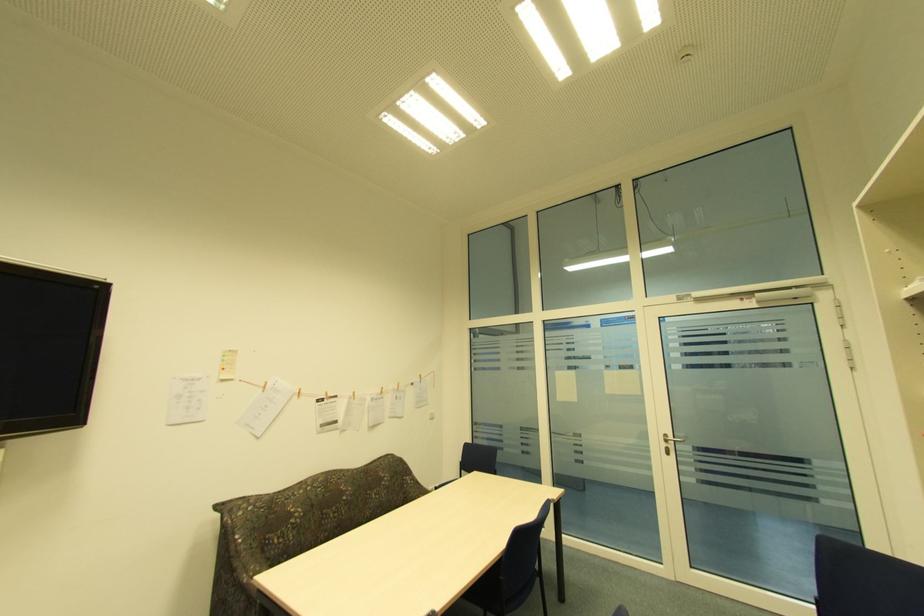
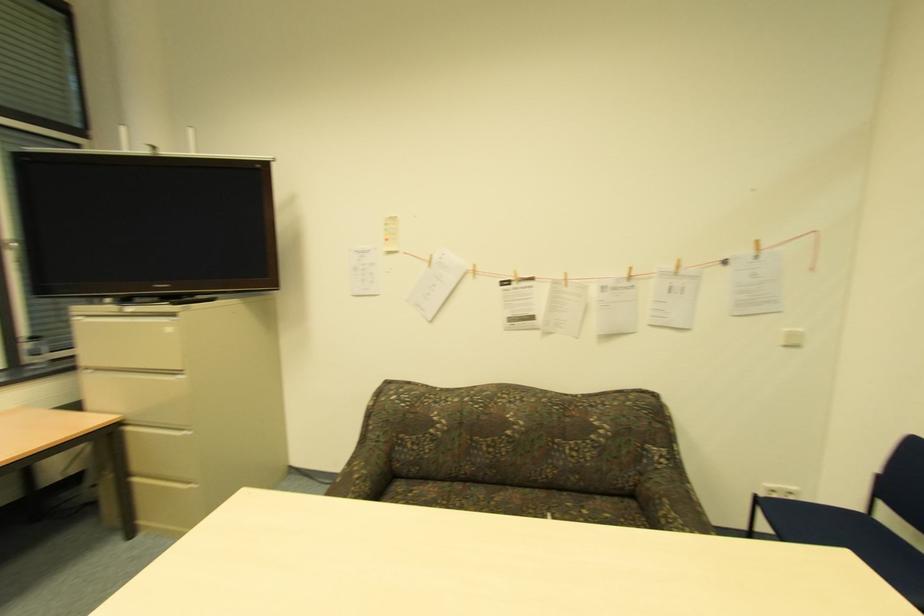
Where in the second image is the point corresponding to point 263,390 from the first image?

(428, 265)